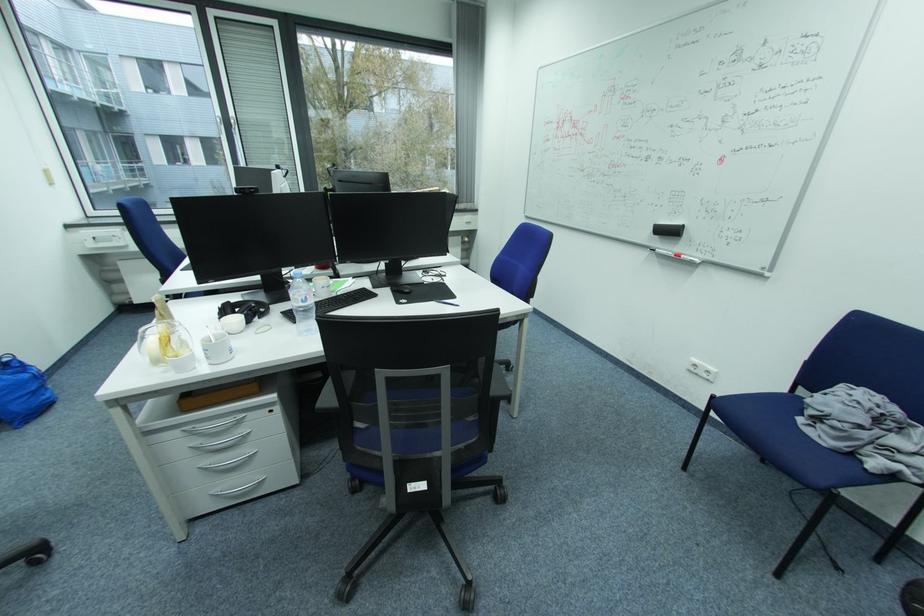
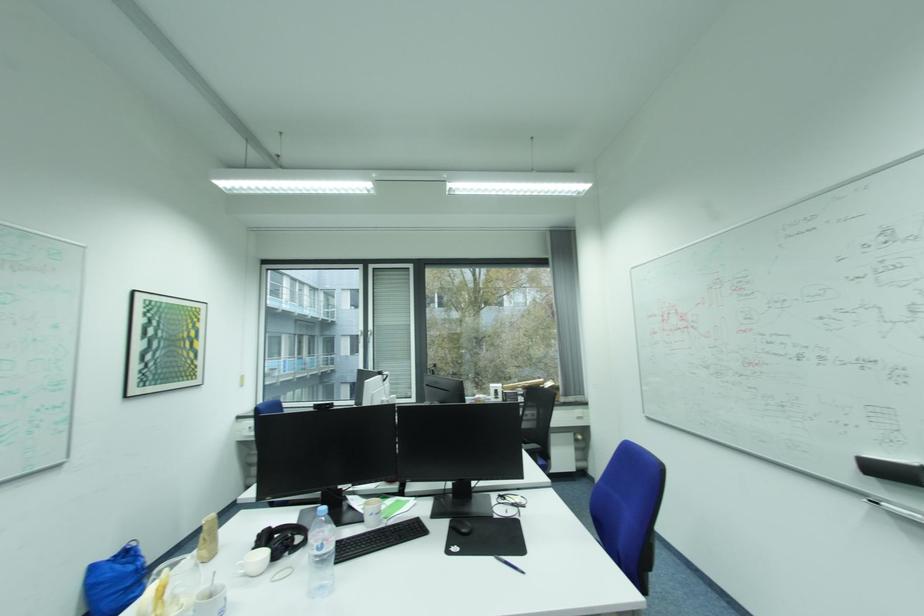
Locate, in the second image, the point that corresponds to the point at 665,237 in the first image.

(880, 477)